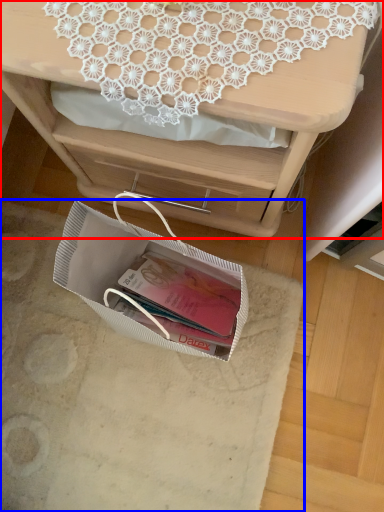
Question: Which of the following is the closest to the observer, desk (highlighted by a red box) or place mat (highlighted by a blue box)?

Choices:
 (A) desk
 (B) place mat

Answer: (A)